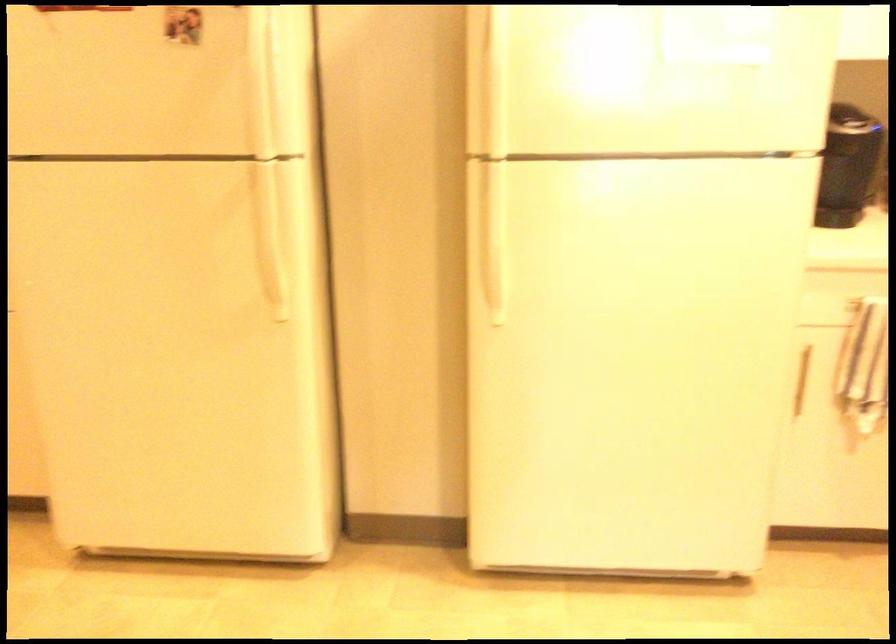
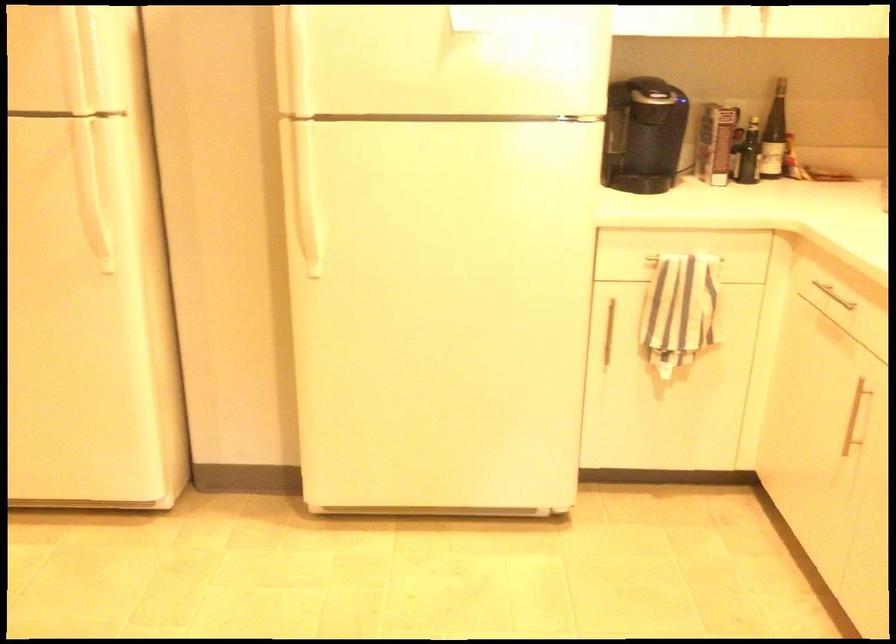
Question: The images are taken continuously from a first-person perspective. In which direction is your viewpoint rotating?

Choices:
 (A) Left
 (B) Right
 (C) Up
 (D) Down

Answer: (B)